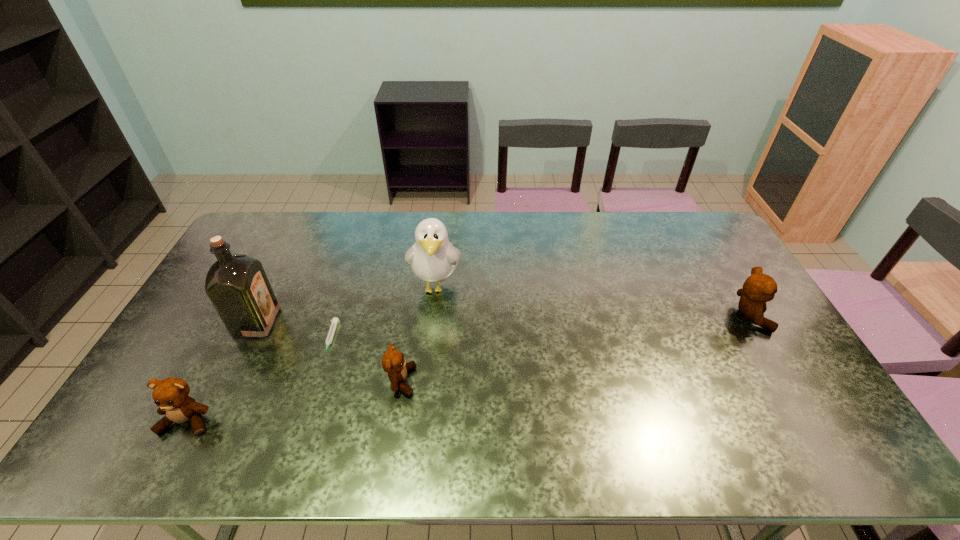
Locate an element on the screen. Image resolution: width=960 pixels, height=540 pixels. blank space located 0.370m on the front-facing side of the shortest teddy bear is located at coordinates (551, 381).

This screenshot has width=960, height=540. What are the coordinates of `free space located at the needle end of the syringe` in the screenshot? It's located at (321, 373).

You are a GUI agent. You are given a task and a screenshot of the screen. Output one action in this format:
    pyautogui.click(x=<x>, y=<y>)
    Task: Click on the blank area located 0.220m on the label of the liquor
    This screenshot has height=540, width=960.
    Given the screenshot: What is the action you would take?
    pyautogui.click(x=348, y=322)

What are the coordinates of `free location located on the beak of the gull` in the screenshot? It's located at (427, 372).

I want to click on teddy bear that is at the left edge, so point(171,396).

Locate an element on the screen. liquor situated at the left edge is located at coordinates (237, 285).

The height and width of the screenshot is (540, 960). Identify the location of object that is at the right edge. (759, 288).

At what (x,y) coordinates should I click in order to perform the action: click on object that is at the near left corner. Please return your answer as a coordinate pair (x, y). The image size is (960, 540). Looking at the image, I should click on (171, 396).

At what (x,y) coordinates should I click in order to perform the action: click on vacant space at the far edge. Please return your answer as a coordinate pair (x, y). This screenshot has height=540, width=960. Looking at the image, I should click on (471, 217).

You are a GUI agent. You are given a task and a screenshot of the screen. Output one action in this format:
    pyautogui.click(x=<x>, y=<y>)
    Task: Click on the vacant region at the near edge
    
    Given the screenshot: What is the action you would take?
    pyautogui.click(x=716, y=420)